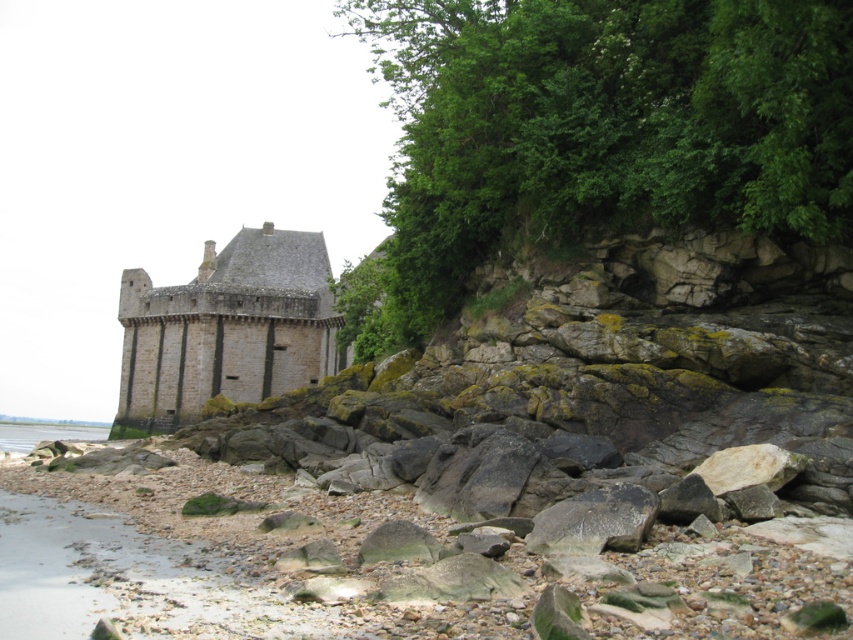
Does point (664, 102) come behind point (10, 438)?

No, it is in front of (10, 438).

Between green leafy tree at upper right and clear water at lower left, which one appears on the right side from the viewer's perspective?

green leafy tree at upper right

This screenshot has width=853, height=640. What are the coordinates of `green leafy tree at upper right` in the screenshot? It's located at (595, 132).

Who is higher up, green leafy tree at upper right or stone gray castle at center?

green leafy tree at upper right is above.

Is green leafy tree at upper right to the left of stone gray castle at center from the viewer's perspective?

Incorrect, green leafy tree at upper right is not on the left side of stone gray castle at center.

Measure the distance between green leafy tree at upper right and camera.

green leafy tree at upper right is 48.03 meters from camera.

At what (x,y) coordinates should I click in order to perform the action: click on green leafy tree at upper right. Please return your answer as a coordinate pair (x, y). Looking at the image, I should click on point(595,132).

Does point (288, 328) come closer to viewer compared to point (108, 426)?

Yes, point (288, 328) is in front of point (108, 426).

Is stone gray castle at center smaller than clear water at lower left?

Yes, stone gray castle at center is smaller than clear water at lower left.

The width and height of the screenshot is (853, 640). What do you see at coordinates (225, 330) in the screenshot?
I see `stone gray castle at center` at bounding box center [225, 330].

At what (x,y) coordinates should I click in order to perform the action: click on stone gray castle at center. Please return your answer as a coordinate pair (x, y). Image resolution: width=853 pixels, height=640 pixels. Looking at the image, I should click on (225, 330).